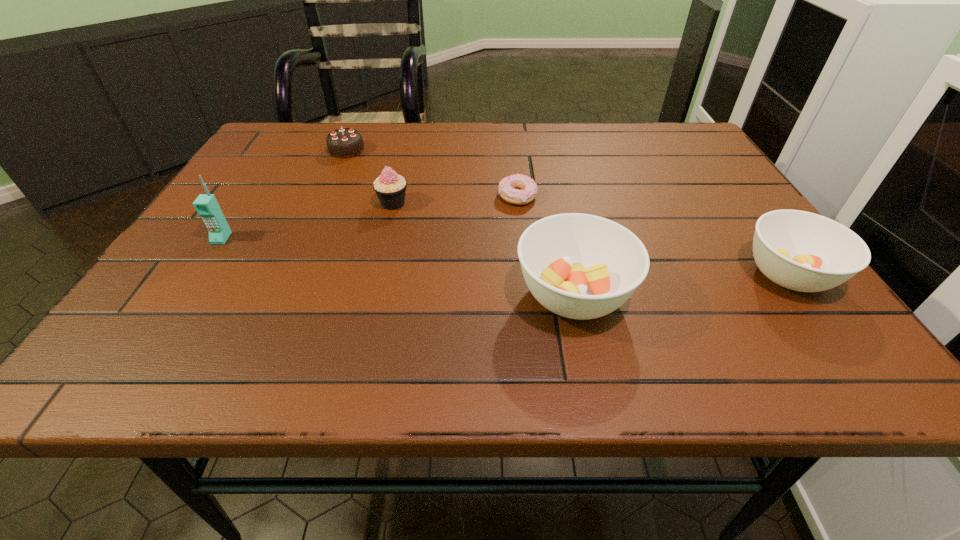
In the current image, all soup bowls are evenly spaced. To maintain this equal spacing, where should an additional soup bowl be placed on the left? Please point out a free spot. Please provide its 2D coordinates. Your answer should be formatted as a tuple, i.e. [(x, y)], where the tuple contains the x and y coordinates of a point satisfying the conditions above.

[(337, 318)]